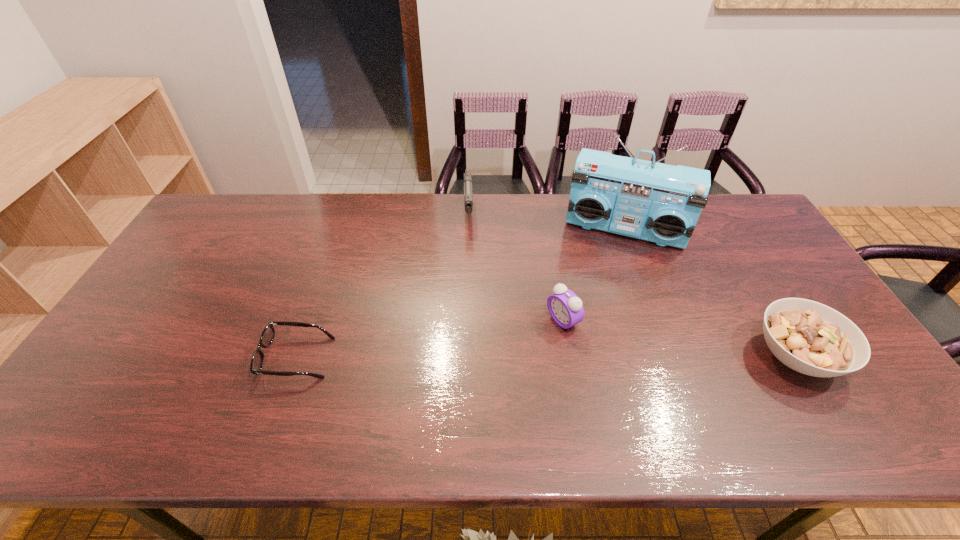
Find the location of `vacant spot on the desktop that is between the spectacles and the stew and is positioned in the direction the fourth object from right to left is aimed`. vacant spot on the desktop that is between the spectacles and the stew and is positioned in the direction the fourth object from right to left is aimed is located at coordinates (473, 357).

Find the location of a particular element. The width and height of the screenshot is (960, 540). vacant space on the desktop that is between the shortest object and the stew and is positioned on the front-facing side of the tallest object is located at coordinates (594, 357).

At what (x,y) coordinates should I click in order to perform the action: click on vacant space on the desktop that is between the shortest object and the stew and is positioned on the face of the alarm clock. Please return your answer as a coordinate pair (x, y). The height and width of the screenshot is (540, 960). Looking at the image, I should click on (497, 357).